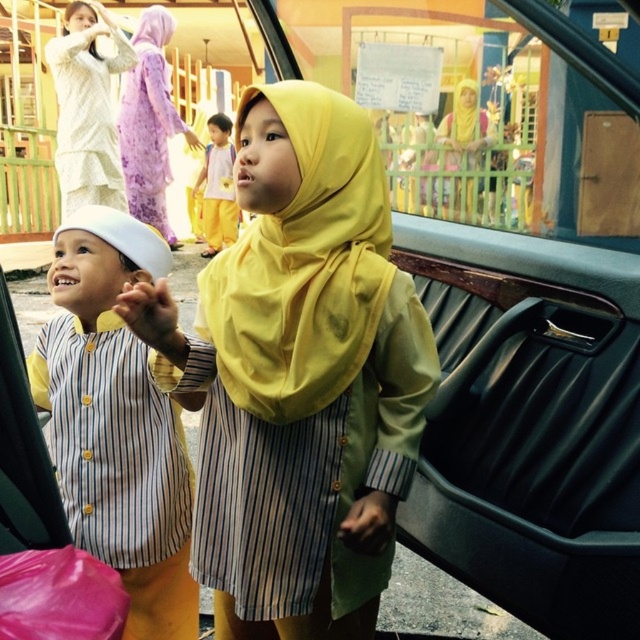
You are a photographer trying to capture a clear shot of the yellow striped shirt at left and the transparent glass car window at upper center. Which object is shorter and might require adjusting your camera angle to ensure both are fully visible?

The transparent glass car window at upper center is shorter than the yellow striped shirt at left, so you should adjust your camera angle to account for the height difference between the two objects to ensure both are fully visible.

You are standing in front of the car and want to locate the white lace dress at upper left. According to the coordinates given, where would you look relative to the car?

The white lace dress at upper left is located at coordinates point (x=86, y=108), which would be near the top left corner of the car.

You are a photographer trying to capture the best angle of the scene. The white lace dress at upper left is located at point (86,108). Where should you position your camera to ensure the white lace dress at upper left is centered in the frame?

To center the white lace dress at upper left, position your camera so that the lens aligns with the coordinates 0.170 on the x and 0.136 on the y axis.